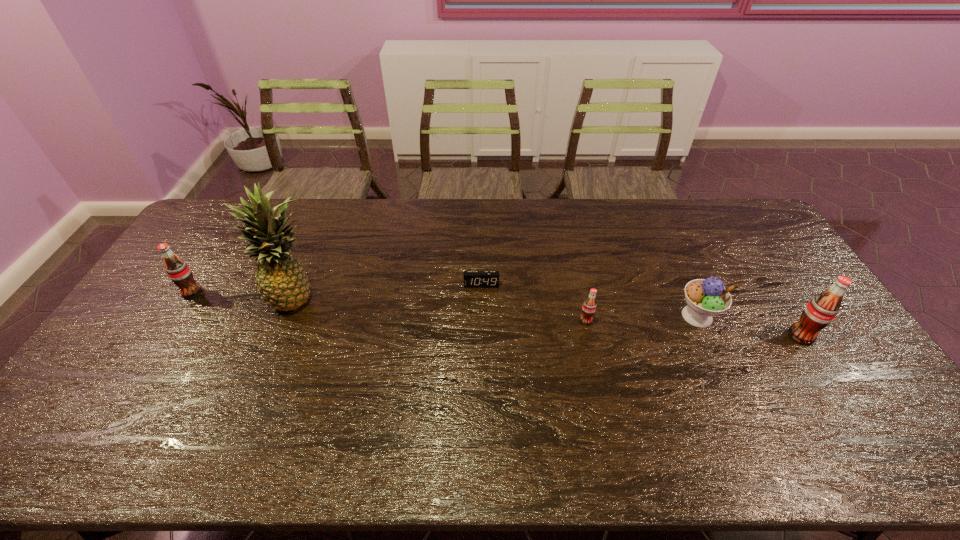
I want to click on vacant region at the far edge, so click(607, 225).

You are a GUI agent. You are given a task and a screenshot of the screen. Output one action in this format:
    pyautogui.click(x=<x>, y=<y>)
    Task: Click on the vacant space at the near edge of the desktop
    This screenshot has height=540, width=960.
    Given the screenshot: What is the action you would take?
    pyautogui.click(x=256, y=399)

Where is `vacant space at the right edge`? The width and height of the screenshot is (960, 540). vacant space at the right edge is located at coordinates click(x=803, y=301).

At what (x,y) coordinates should I click in order to perform the action: click on free location at the far left corner. Please return your answer as a coordinate pair (x, y). Looking at the image, I should click on (221, 219).

This screenshot has height=540, width=960. In order to click on vacant space at the near left corner of the desktop in this screenshot , I will do `click(105, 392)`.

In order to click on vacant region between the second object from right to left and the pineapple in this screenshot , I will do `click(497, 306)`.

Find the location of a particular element. This screenshot has width=960, height=540. empty space that is in between the third shortest object and the pineapple is located at coordinates (497, 306).

Locate an element on the screen. The width and height of the screenshot is (960, 540). empty space that is in between the second tallest soda and the second object from right to left is located at coordinates tap(444, 305).

Where is `blank region between the shortest object and the second soda from right to left`? The height and width of the screenshot is (540, 960). blank region between the shortest object and the second soda from right to left is located at coordinates (534, 303).

Locate an element on the screen. Image resolution: width=960 pixels, height=540 pixels. free space between the pineapple and the fourth object from right to left is located at coordinates (389, 291).